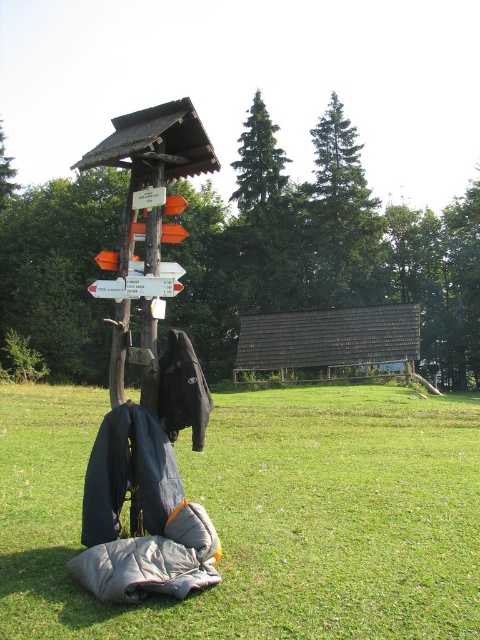
From the picture: You are standing at the wooden post with directional signs and need to reach the brown shingled hut at center. According to the coordinates provided, in which direction should you head from the post to reach the hut?

The brown shingled hut at center is located at point [327,342], so you should head towards the center of the image from the post to reach it.

Based on the photo, you are a hiker who wants to know if the gray fabric sleeping bag at lower center can fit inside the brown shingled hut at center. Can you determine this based on their heights?

The gray fabric sleeping bag at lower center has a lesser height compared to brown shingled hut at center, so it can fit inside the hut since its height is smaller than the hut.

You are standing at the campsite and need to locate the gray fabric sleeping bag at lower center. According to the coordinates provided, where exactly is it positioned?

The gray fabric sleeping bag at lower center is located at point coordinates of [264,515].